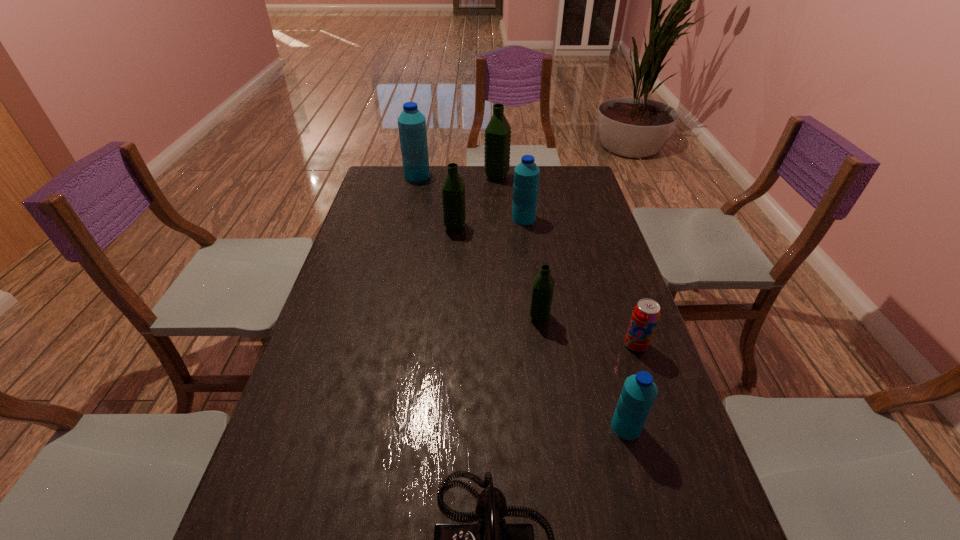
The width and height of the screenshot is (960, 540). What are the coordinates of `free spot between the leftmost blue water bottle and the rightmost green water bottle` in the screenshot? It's located at (478, 246).

Identify the location of vacant area that lies between the seventh farthest object and the second farthest green water bottle. (540, 327).

Find the location of a particular element. The width and height of the screenshot is (960, 540). free point between the smallest blue water bottle and the smallest green water bottle is located at coordinates (583, 372).

Identify the location of free area in between the biggest green water bottle and the leftmost green water bottle. (476, 202).

Find the location of `free space between the soda can and the biggest blue water bottle`. free space between the soda can and the biggest blue water bottle is located at coordinates (526, 260).

Locate an element on the screen. free spot between the second water bottle from left to right and the leftmost object is located at coordinates (436, 201).

Where is `blank region between the farthest blue water bottle and the fifth water bottle from right to left`? This screenshot has width=960, height=540. blank region between the farthest blue water bottle and the fifth water bottle from right to left is located at coordinates (436, 201).

In order to click on empty location between the rightmost green water bottle and the second farthest blue water bottle in this screenshot , I will do `click(532, 267)`.

You are a GUI agent. You are given a task and a screenshot of the screen. Output one action in this format:
    pyautogui.click(x=<x>, y=<y>)
    Task: Click on the object identified as the third closest to the soda can
    This screenshot has height=540, width=960.
    Given the screenshot: What is the action you would take?
    pyautogui.click(x=490, y=539)

Point out which object is positioned as the fourth nearest to the black telephone. Please provide its 2D coordinates. Your answer should be formatted as a tuple, i.e. [(x, y)], where the tuple contains the x and y coordinates of a point satisfying the conditions above.

[(453, 190)]